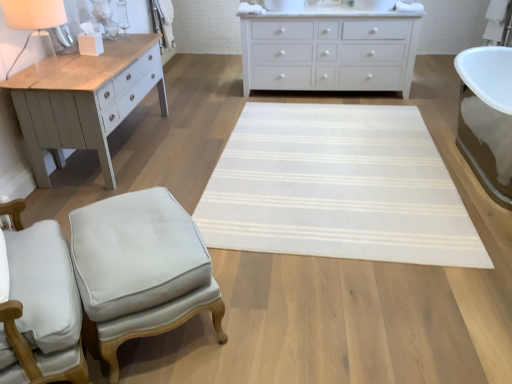
Question: From the image's perspective, relative to light gray fabric stool at lower left, is white matte chest of drawers at upper center above or below?

Choices:
 (A) below
 (B) above

Answer: (B)

Question: Considering the positions of white matte chest of drawers at upper center and light gray fabric stool at lower left in the image, is white matte chest of drawers at upper center taller or shorter than light gray fabric stool at lower left?

Choices:
 (A) short
 (B) tall

Answer: (B)

Question: Which is farther from the light gray fabric stool at lower left?

Choices:
 (A) white matte table lamp at upper left
 (B) white matte chest of drawers at upper center
 (C) white woven mat at center
 (D) white fabric chair at lower left

Answer: (B)

Question: Based on their relative distances, which object is nearer to the white matte table lamp at upper left?

Choices:
 (A) white matte chest of drawers at upper center
 (B) light gray fabric stool at lower left
 (C) white woven mat at center
 (D) white fabric chair at lower left

Answer: (D)